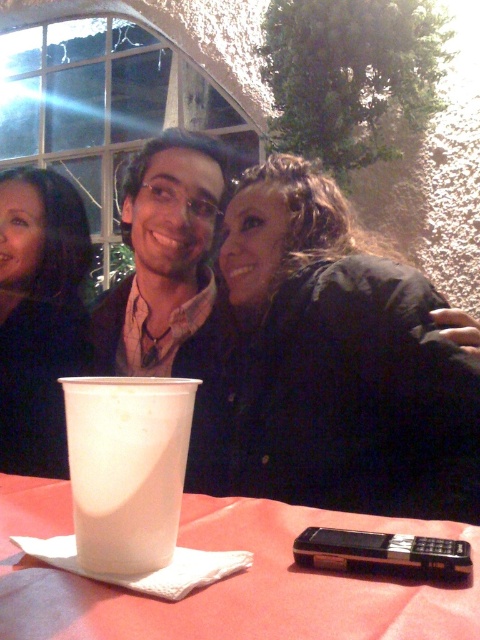
Who is positioned more to the left, white paper cup at center or white plastic cup at center?

Positioned to the left is white plastic cup at center.

Can you confirm if white paper cup at center is positioned to the right of white plastic cup at center?

Indeed, white paper cup at center is positioned on the right side of white plastic cup at center.

You are a GUI agent. You are given a task and a screenshot of the screen. Output one action in this format:
    pyautogui.click(x=<x>, y=<y>)
    Task: Click on the white paper cup at center
    The height and width of the screenshot is (640, 480).
    Given the screenshot: What is the action you would take?
    pyautogui.click(x=226, y=579)

This screenshot has height=640, width=480. What are the coordinates of `white paper cup at center` in the screenshot? It's located at (226, 579).

Is black matte jacket at center thinner than matte black shirt at center?

Incorrect, black matte jacket at center's width is not less than matte black shirt at center's.

Is black matte jacket at center to the right of matte black shirt at center from the viewer's perspective?

Indeed, black matte jacket at center is positioned on the right side of matte black shirt at center.

The width and height of the screenshot is (480, 640). What do you see at coordinates (337, 362) in the screenshot?
I see `black matte jacket at center` at bounding box center [337, 362].

I want to click on black matte jacket at center, so click(337, 362).

Based on the photo, who is taller, matte black hair at upper left or white plastic cup at center?

matte black hair at upper left

Is matte black hair at upper left positioned before white plastic cup at center?

No, matte black hair at upper left is behind white plastic cup at center.

At what (x,y) coordinates should I click in order to perform the action: click on matte black hair at upper left. Please return your answer as a coordinate pair (x, y). Looking at the image, I should click on (38, 316).

This screenshot has width=480, height=640. I want to click on matte black hair at upper left, so pos(38,316).